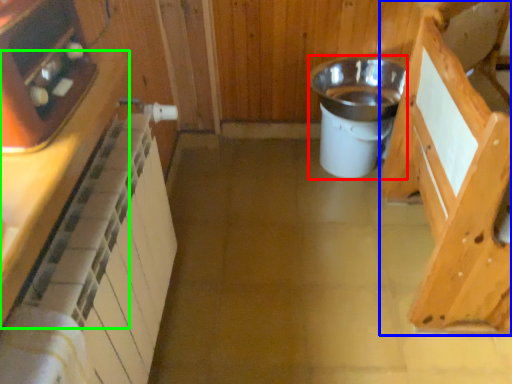
Question: Which object is positioned farthest from appliance (highlighted by a red box)? Select from cabinetry (highlighted by a blue box) and cabinetry (highlighted by a green box).

Choices:
 (A) cabinetry
 (B) cabinetry

Answer: (B)